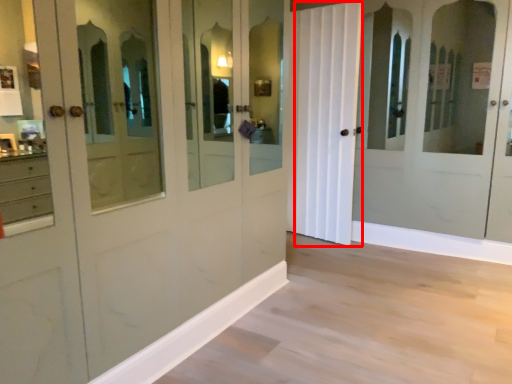
Question: From the image's perspective, where is curtain (annotated by the red box) located in relation to molding in the image?

Choices:
 (A) below
 (B) above

Answer: (B)